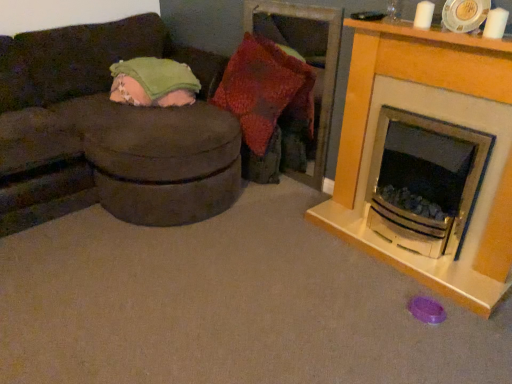
What do you see at coordinates (440, 119) in the screenshot? The width and height of the screenshot is (512, 384). I see `white glossy fireplace at right` at bounding box center [440, 119].

Find the location of `suede-like brown studio couch at left`. suede-like brown studio couch at left is located at coordinates (109, 132).

You are a GUI agent. You are given a task and a screenshot of the screen. Output one action in this format:
    pyautogui.click(x=<x>, y=<y>)
    Task: Click on the studio couch on the left of knitted fabric pillow at center
    The height and width of the screenshot is (384, 512).
    Given the screenshot: What is the action you would take?
    pyautogui.click(x=109, y=132)

Considering the sizes of objects suede-like brown studio couch at left and knitted fabric pillow at center in the image provided, who is bigger, suede-like brown studio couch at left or knitted fabric pillow at center?

suede-like brown studio couch at left is bigger.

From a real-world perspective, which is physically below, suede-like brown studio couch at left or knitted fabric pillow at center?

From a 3D spatial view, suede-like brown studio couch at left is below.

Is there a large distance between suede-like brown studio couch at left and knitted fabric pillow at center?

No, there isn't a large distance between suede-like brown studio couch at left and knitted fabric pillow at center.

Can you confirm if knitted fabric pillow at center is thinner than suede-like brown studio couch at left?

Yes, knitted fabric pillow at center is thinner than suede-like brown studio couch at left.

Considering the positions of objects knitted fabric pillow at center and suede-like brown studio couch at left in the image provided, who is more to the left, knitted fabric pillow at center or suede-like brown studio couch at left?

Positioned to the left is suede-like brown studio couch at left.

Is there a large distance between knitted fabric pillow at center and suede-like brown studio couch at left?

Actually, knitted fabric pillow at center and suede-like brown studio couch at left are a little close together.

Locate an element on the screen. The height and width of the screenshot is (384, 512). fireplace in front of the knitted fabric pillow at center is located at coordinates (440, 119).

Is white glossy fireplace at right to the left of knitted fabric pillow at center from the viewer's perspective?

No.

Is white glossy fireplace at right positioned in front of knitted fabric pillow at center?

Yes, white glossy fireplace at right is in front of knitted fabric pillow at center.

Is knitted fabric pillow at center located within white glossy fireplace at right?

No, knitted fabric pillow at center is not inside white glossy fireplace at right.

Is point (510, 116) more distant than point (42, 76)?

No, (510, 116) is in front of (42, 76).

Considering the relative positions of white glossy fireplace at right and suede-like brown studio couch at left in the image provided, is white glossy fireplace at right to the right of suede-like brown studio couch at left from the viewer's perspective?

Correct, you'll find white glossy fireplace at right to the right of suede-like brown studio couch at left.

There is a suede-like brown studio couch at left. At what (x,y) coordinates should I click in order to perform the action: click on fireplace above it (from a real-world perspective). Please return your answer as a coordinate pair (x, y). This screenshot has width=512, height=384. Looking at the image, I should click on (440, 119).

From the image's perspective, is white glossy fireplace at right positioned above or below suede-like brown studio couch at left?

From the image's perspective, white glossy fireplace at right appears below suede-like brown studio couch at left.

Can you confirm if suede-like brown studio couch at left is thinner than green soft blanket at upper left?

In fact, suede-like brown studio couch at left might be wider than green soft blanket at upper left.

How far apart are suede-like brown studio couch at left and green soft blanket at upper left?

suede-like brown studio couch at left is 13.93 inches from green soft blanket at upper left.

From a real-world perspective, between suede-like brown studio couch at left and green soft blanket at upper left, who is vertically lower?

suede-like brown studio couch at left, from a real-world perspective.

Considering the positions of points (265, 136) and (119, 66), is point (265, 136) closer to camera compared to point (119, 66)?

Yes.

Can you confirm if knitted fabric pillow at center is wider than green soft blanket at upper left?

No.

Is knitted fabric pillow at center turned away from green soft blanket at upper left?

No.

Which object is more forward, knitted fabric pillow at center or green soft blanket at upper left?

knitted fabric pillow at center is more forward.

Is suede-like brown studio couch at left facing towards white glossy fireplace at right?

Yes, suede-like brown studio couch at left faces towards white glossy fireplace at right.

From a real-world perspective, is suede-like brown studio couch at left positioned above or below white glossy fireplace at right?

suede-like brown studio couch at left is situated lower than white glossy fireplace at right in the real world.

Does point (133, 26) appear closer or farther from the camera than point (482, 120)?

Clearly, point (133, 26) is more distant from the camera than point (482, 120).

In terms of width, does suede-like brown studio couch at left look wider or thinner when compared to white glossy fireplace at right?

suede-like brown studio couch at left is wider than white glossy fireplace at right.

Locate an element on the screen. This screenshot has width=512, height=384. studio couch below the knitted fabric pillow at center (from the image's perspective) is located at coordinates (109, 132).

Locate an element on the screen. This screenshot has height=384, width=512. pillow that appears above the suede-like brown studio couch at left (from a real-world perspective) is located at coordinates (266, 90).

Which object lies nearer to the anchor point suede-like brown studio couch at left, knitted fabric pillow at center or green soft blanket at upper left?

The object closer to suede-like brown studio couch at left is green soft blanket at upper left.

From the image, which object appears to be nearer to knitted fabric pillow at center, suede-like brown studio couch at left or white glossy fireplace at right?

suede-like brown studio couch at left lies closer to knitted fabric pillow at center than the other object.

When comparing their distances from green soft blanket at upper left, does knitted fabric pillow at center or white glossy fireplace at right seem closer?

knitted fabric pillow at center.

From the image, which object appears to be nearer to suede-like brown studio couch at left, knitted fabric pillow at center or white glossy fireplace at right?

Among the two, knitted fabric pillow at center is located nearer to suede-like brown studio couch at left.

Looking at this image, when comparing their distances from suede-like brown studio couch at left, does green soft blanket at upper left or white glossy fireplace at right seem further?

white glossy fireplace at right.

Estimate the real-world distances between objects in this image. Which object is closer to knitted fabric pillow at center, suede-like brown studio couch at left or green soft blanket at upper left?

green soft blanket at upper left is closer to knitted fabric pillow at center.

Looking at the image, which one is located closer to white glossy fireplace at right, suede-like brown studio couch at left or knitted fabric pillow at center?

Among the two, knitted fabric pillow at center is located nearer to white glossy fireplace at right.

When comparing their distances from white glossy fireplace at right, does green soft blanket at upper left or suede-like brown studio couch at left seem further?

green soft blanket at upper left.

Locate an element on the screen. The width and height of the screenshot is (512, 384). pillow between green soft blanket at upper left and white glossy fireplace at right from left to right is located at coordinates (266, 90).

Locate an element on the screen. The height and width of the screenshot is (384, 512). pillow between suede-like brown studio couch at left and green soft blanket at upper left along the z-axis is located at coordinates (266, 90).

Identify the location of pillow situated between suede-like brown studio couch at left and white glossy fireplace at right from left to right. (266, 90).

This screenshot has width=512, height=384. I want to click on blanket situated between suede-like brown studio couch at left and white glossy fireplace at right from left to right, so click(153, 82).